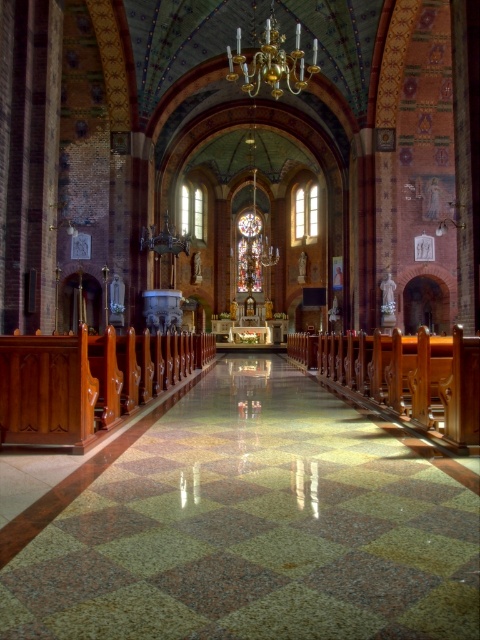
Which of these two, green polished stone aisle at center or clear stained glass window at center, stands taller?

Standing taller between the two is clear stained glass window at center.

Can you confirm if green polished stone aisle at center is shorter than clear stained glass window at center?

Indeed, green polished stone aisle at center has a lesser height compared to clear stained glass window at center.

Does point (68, 545) come closer to viewer compared to point (182, 189)?

That is True.

I want to click on green polished stone aisle at center, so click(x=241, y=524).

Is point (261, 244) in front of point (294, 202)?

No, (261, 244) is further to viewer.

Which of these two, stained glass at center or clear glass window at center, stands taller?

stained glass at center is taller.

Is point (260, 248) in front of point (314, 205)?

No, it is not.

This screenshot has width=480, height=640. Identify the location of stained glass at center. (250, 252).

Is clear glass window at center above clear stained glass window at center?

Yes.

What do you see at coordinates (304, 211) in the screenshot? I see `clear glass window at center` at bounding box center [304, 211].

Between point (307, 224) and point (201, 212), which one is positioned behind?

Positioned behind is point (201, 212).

Identify the location of clear glass window at center. The width and height of the screenshot is (480, 640). 304,211.